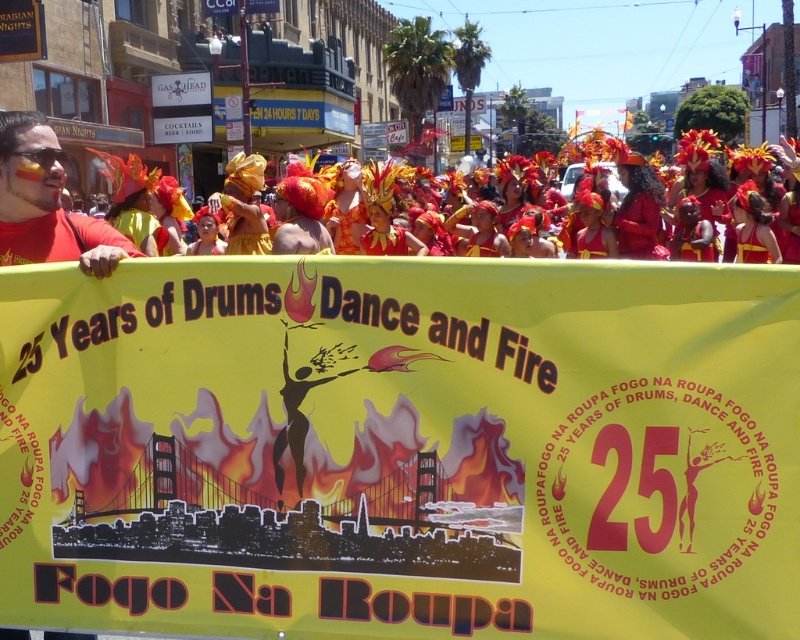
Question: In this image, where is yellow paper banner at center located relative to matte red costume at center?

Choices:
 (A) above
 (B) below

Answer: (B)

Question: Based on their relative distances, which object is farther from the matte red shirt at left?

Choices:
 (A) shiny metallic headdress at center
 (B) matte red costume at center
 (C) shiny gold headpiece at upper right

Answer: (A)

Question: Estimate the real-world distances between objects in this image. Which object is farther from the matte red costume at center?

Choices:
 (A) shiny gold headpiece at upper right
 (B) matte red shirt at left

Answer: (B)

Question: Does matte red shirt at lower left appear on the left side of matte red shirt at left?

Choices:
 (A) yes
 (B) no

Answer: (B)

Question: Which object appears farthest from the camera in this image?

Choices:
 (A) matte red shirt at left
 (B) shiny gold headpiece at upper right

Answer: (B)

Question: Is matte red shirt at lower left to the right of matte red shirt at left from the viewer's perspective?

Choices:
 (A) yes
 (B) no

Answer: (A)